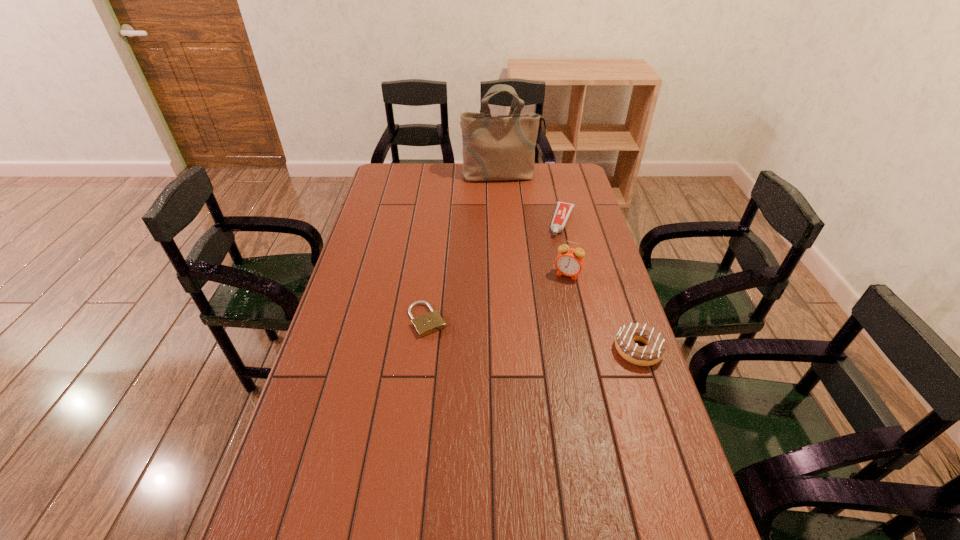
Find the location of `vacant area that lies between the second shortest object and the doughnut`. vacant area that lies between the second shortest object and the doughnut is located at coordinates (600, 286).

I want to click on free space between the fourth nearest object and the doughnut, so click(600, 286).

At what (x,y) coordinates should I click in order to perform the action: click on free area in between the fourth tallest object and the rightmost object. Please return your answer as a coordinate pair (x, y). The height and width of the screenshot is (540, 960). Looking at the image, I should click on (600, 286).

Identify the location of vacant region between the second farthest object and the leftmost object. The width and height of the screenshot is (960, 540). pyautogui.click(x=494, y=271).

Image resolution: width=960 pixels, height=540 pixels. I want to click on vacant area between the farthest object and the padlock, so click(x=465, y=248).

Where is `free area in between the doughnut and the leftmost object`? The width and height of the screenshot is (960, 540). free area in between the doughnut and the leftmost object is located at coordinates (533, 335).

Select which object is the third closest to the alarm clock. Please provide its 2D coordinates. Your answer should be formatted as a tuple, i.e. [(x, y)], where the tuple contains the x and y coordinates of a point satisfying the conditions above.

[(431, 322)]

Locate an element on the screen. The width and height of the screenshot is (960, 540). object that stands as the second closest to the alarm clock is located at coordinates (654, 351).

Identify the location of free space that satisfies the following two spatial constraints: 1. on the front side of the second shortest object; 2. on the left side of the tallest object. The height and width of the screenshot is (540, 960). (505, 221).

The height and width of the screenshot is (540, 960). What are the coordinates of `free space that satisfies the following two spatial constraints: 1. on the front side of the rightmost object; 2. on the left side of the fourth tallest object` in the screenshot? It's located at (593, 350).